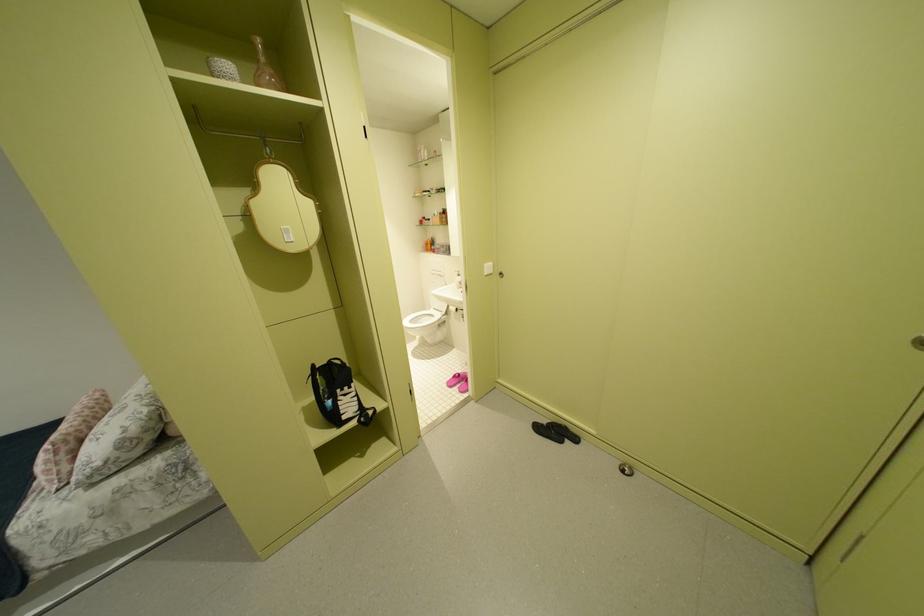
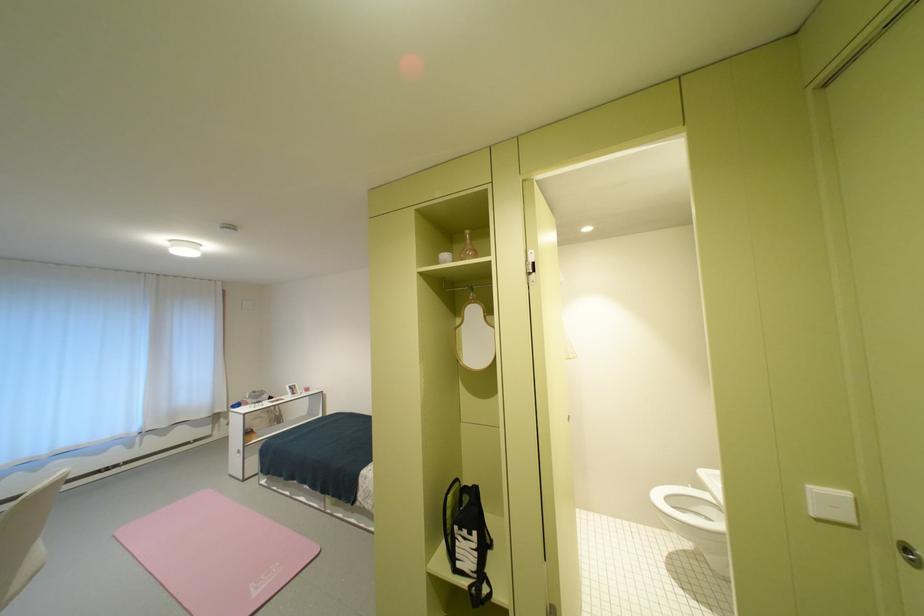
Locate, in the second image, the point that corresponds to point 494,265 in the first image.

(821, 488)